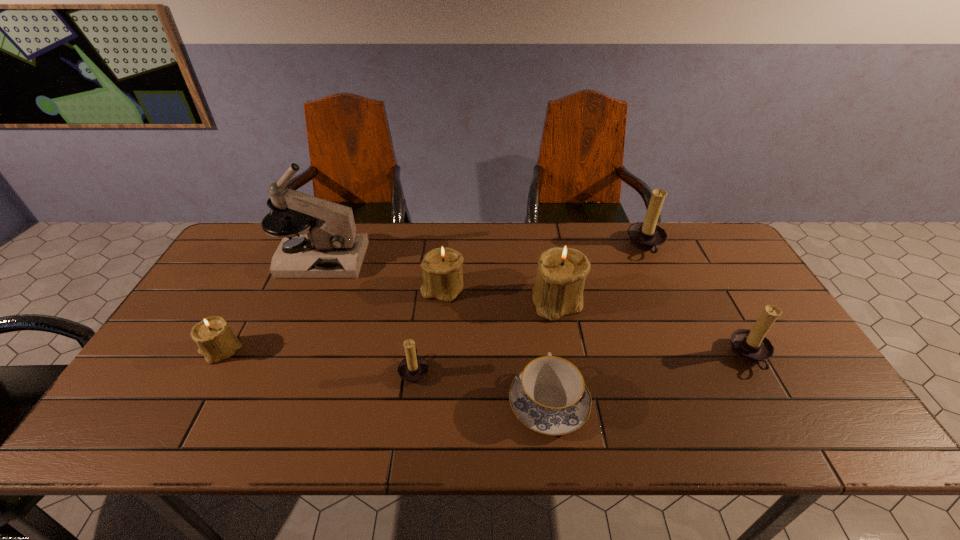
At what (x,y) coordinates should I click in order to perform the action: click on vacant position located on the wick of the second smallest brown candle holder. Please return your answer as a coordinate pair (x, y). This screenshot has width=960, height=540. Looking at the image, I should click on (625, 356).

Where is `free space located on the wick of the second smallest brown candle holder`? free space located on the wick of the second smallest brown candle holder is located at coordinates [x=610, y=356].

The height and width of the screenshot is (540, 960). In order to click on vacant space located 0.330m on the back of the smallest beige candle_holder in this screenshot , I will do `click(272, 258)`.

This screenshot has height=540, width=960. I want to click on vacant position located on the wick of the leftmost brown candle holder, so click(493, 370).

This screenshot has height=540, width=960. What are the coordinates of `vacant area located 0.290m with the handle on the side of the shortest object` in the screenshot? It's located at (534, 289).

Identify the location of vacant area situated with the handle on the side of the shortest object. (531, 269).

Image resolution: width=960 pixels, height=540 pixels. Find the location of `vacant space located 0.100m with the handle on the side of the shortest object`. vacant space located 0.100m with the handle on the side of the shortest object is located at coordinates (540, 338).

You are a GUI agent. You are given a task and a screenshot of the screen. Output one action in this format:
    pyautogui.click(x=<x>, y=<y>)
    Task: Click on the microscope that is at the far edge
    This screenshot has width=960, height=540.
    Given the screenshot: What is the action you would take?
    pyautogui.click(x=330, y=248)

Where is `candle holder at the far edge`? candle holder at the far edge is located at coordinates (647, 236).

Find the location of a particular element. This screenshot has height=540, width=960. object situated at the near edge is located at coordinates (549, 396).